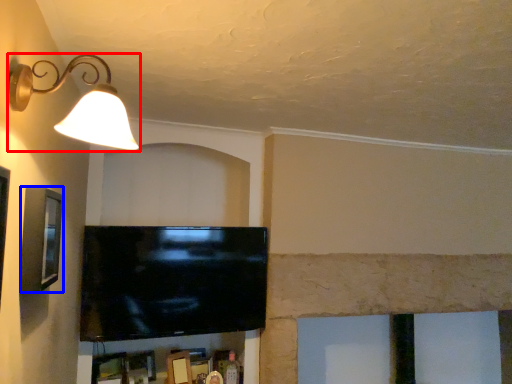
Question: Which point is further to the camera, lamp (highlighted by a red box) or picture frame (highlighted by a blue box)?

Choices:
 (A) lamp
 (B) picture frame

Answer: (B)